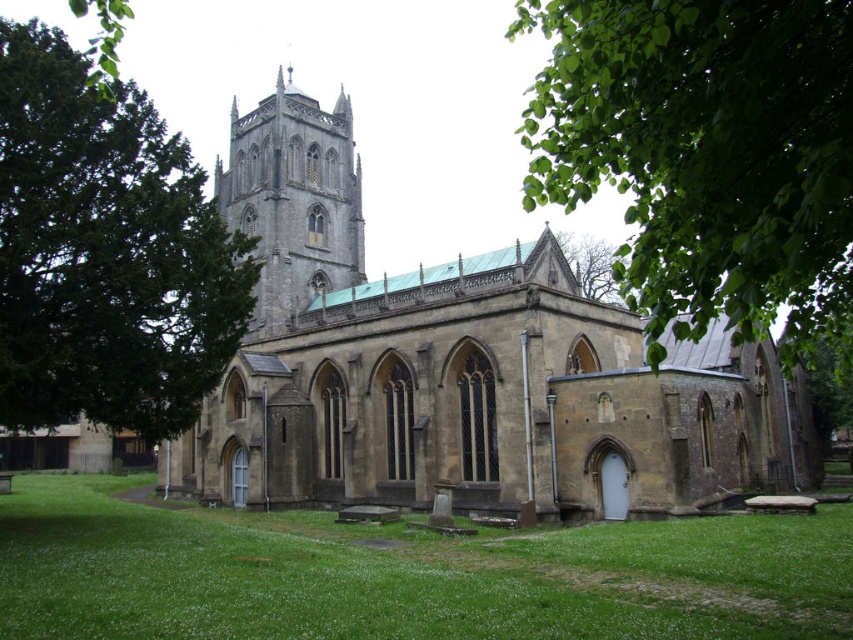
Who is positioned more to the right, stone tower at center or green leafy tree at upper center?

green leafy tree at upper center

Between point (294, 228) and point (584, 250), which one is positioned in front?

Point (294, 228)

Which is in front, point (225, 204) or point (595, 289)?

Point (225, 204)

The image size is (853, 640). Identify the location of stone tower at center. (294, 200).

Looking at this image, is green leafy tree at upper right to the left of green leafy tree at upper center from the viewer's perspective?

No, green leafy tree at upper right is not to the left of green leafy tree at upper center.

Is green leafy tree at upper right smaller than green leafy tree at upper center?

No.

You are a GUI agent. You are given a task and a screenshot of the screen. Output one action in this format:
    pyautogui.click(x=<x>, y=<y>)
    Task: Click on the green leafy tree at upper right
    The height and width of the screenshot is (640, 853).
    Given the screenshot: What is the action you would take?
    pyautogui.click(x=706, y=156)

Is green leafy tree at upper right further to camera compared to stone tower at center?

That is False.

How much distance is there between green leafy tree at upper right and stone tower at center?

A distance of 50.79 meters exists between green leafy tree at upper right and stone tower at center.

Does point (599, 145) come behind point (254, 230)?

No, (599, 145) is in front of (254, 230).

Where is `green leafy tree at upper right`? The image size is (853, 640). green leafy tree at upper right is located at coordinates (706, 156).